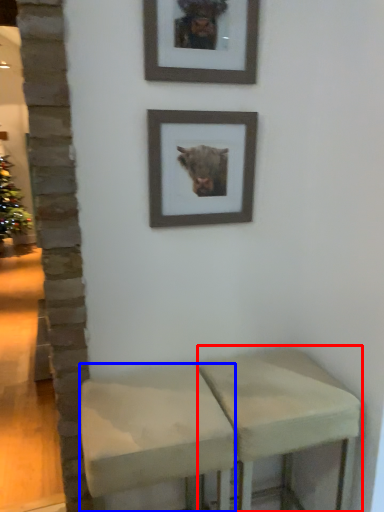
Question: Which object is further to the camera taking this photo, stool (highlighted by a red box) or stool (highlighted by a blue box)?

Choices:
 (A) stool
 (B) stool

Answer: (A)